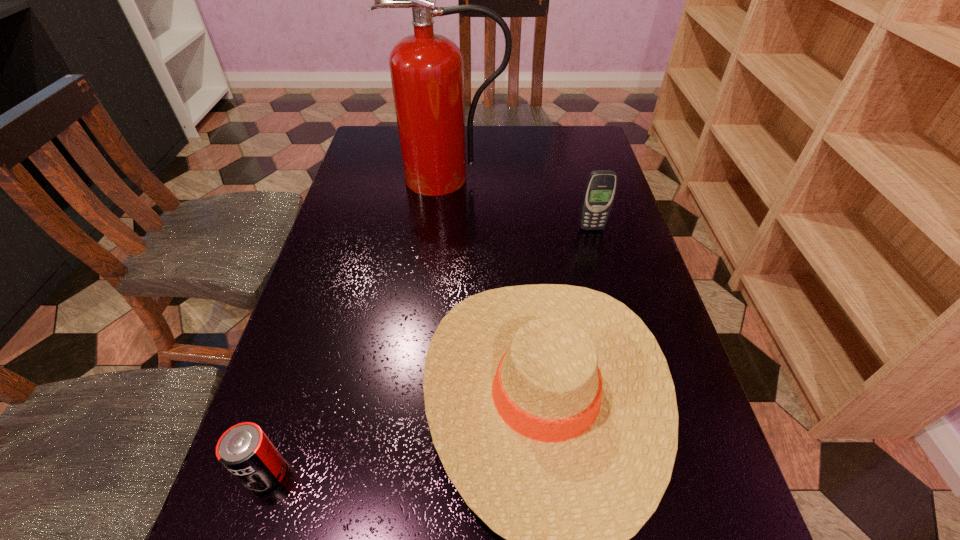
The height and width of the screenshot is (540, 960). In order to click on the tallest object in this screenshot , I will do `click(427, 73)`.

Locate an element on the screen. The image size is (960, 540). fire extinguisher is located at coordinates (427, 73).

This screenshot has height=540, width=960. What are the coordinates of `the second tallest object` in the screenshot? It's located at (600, 189).

I want to click on cellular telephone, so click(600, 189).

I want to click on can, so click(244, 449).

The width and height of the screenshot is (960, 540). Identify the location of vacant space situated 0.320m with the handle and nozzle on the fire extinguisher. (442, 279).

The height and width of the screenshot is (540, 960). What are the coordinates of `vacant point located 0.380m on the screen of the second tallest object` in the screenshot? It's located at (626, 356).

Where is `free point located 0.360m on the right of the leftmost object`? The image size is (960, 540). free point located 0.360m on the right of the leftmost object is located at coordinates (511, 474).

Locate an element on the screen. The width and height of the screenshot is (960, 540). object that is at the far edge is located at coordinates (427, 73).

Where is `fire extinguisher present at the left edge`? The image size is (960, 540). fire extinguisher present at the left edge is located at coordinates (427, 73).